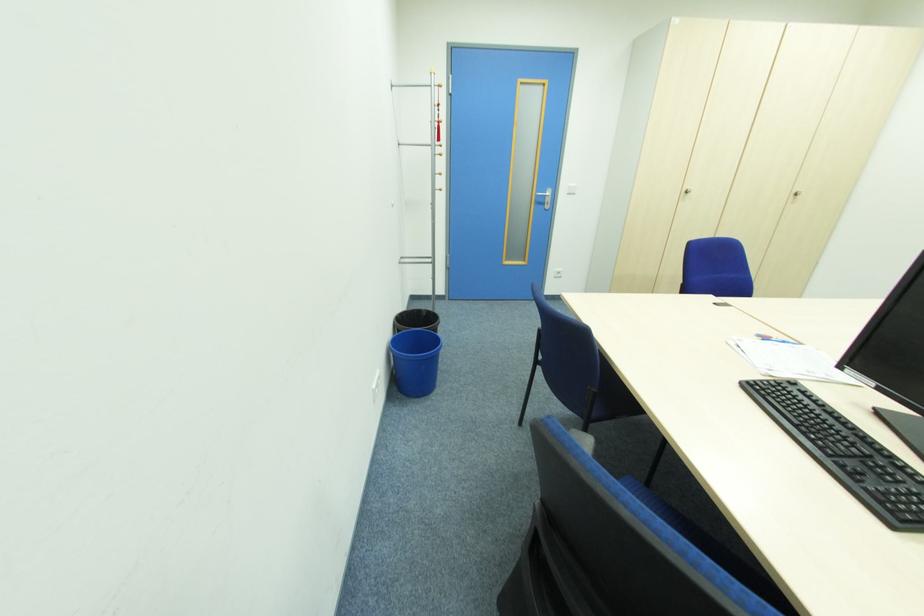
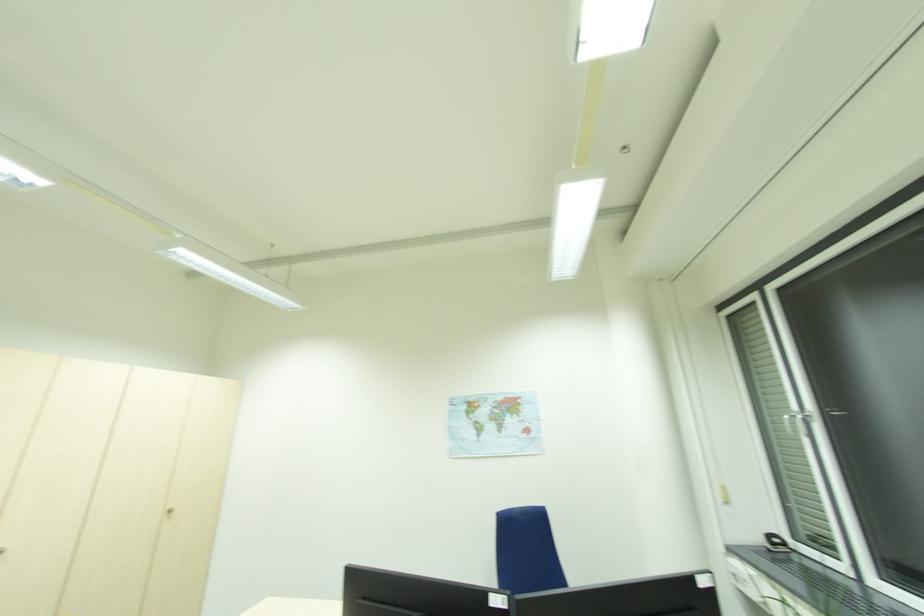
Based on the photo, the first image is from the beginning of the video and the second image is from the end. How did the camera likely rotate when shooting the video?

The camera rotated toward right-up.